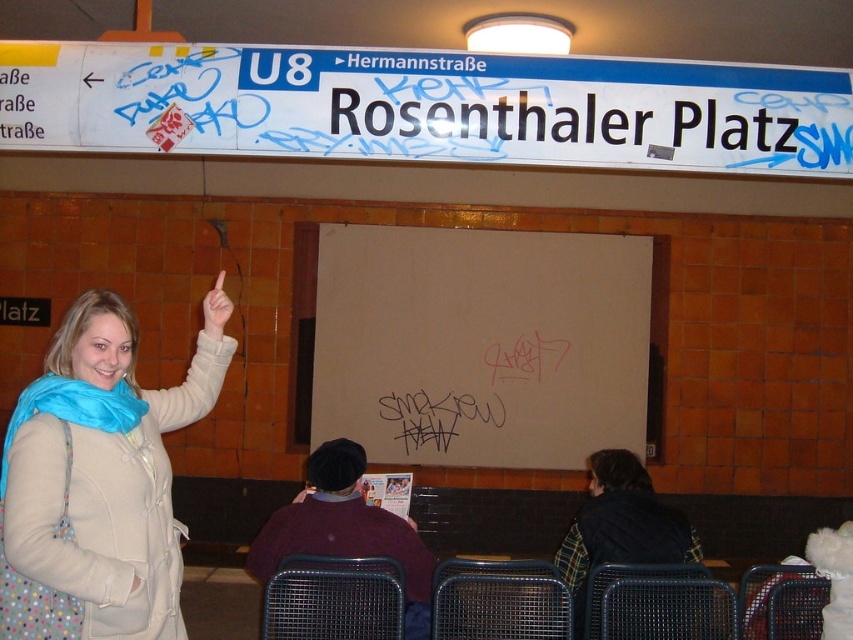
You are a commuter waiting at Rosenthaler Platz station and notice two items hanging on a nearby wall. The beige fabric coat at upper left and the flannel shirt at lower right. Which item is closer to you?

The beige fabric coat at upper left is closer to you because it is positioned nearer to the viewer compared to the flannel shirt at lower right.

You are a graffiti artist planning to add a new piece to the white matte board at center. To ensure your artwork aligns with the existing graffiti on the board, where should you position your new design relative to the board?

The white matte board at center is located at the coordinates point (480, 344), so you should position your new design at that central point to align with the existing graffiti on the board.